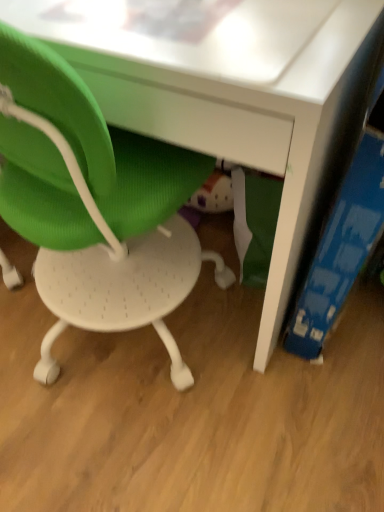
Question: Is green mesh chair at lower left inside blue cardboard book at right?

Choices:
 (A) no
 (B) yes

Answer: (A)

Question: Is blue cardboard book at right outside green mesh chair at lower left?

Choices:
 (A) no
 (B) yes

Answer: (B)

Question: From a real-world perspective, does blue cardboard book at right sit lower than green mesh chair at lower left?

Choices:
 (A) no
 (B) yes

Answer: (B)

Question: From a real-world perspective, does blue cardboard book at right stand above green mesh chair at lower left?

Choices:
 (A) yes
 (B) no

Answer: (B)

Question: Can you confirm if blue cardboard book at right is thinner than green mesh chair at lower left?

Choices:
 (A) no
 (B) yes

Answer: (B)

Question: Are blue cardboard book at right and green mesh chair at lower left beside each other?

Choices:
 (A) no
 (B) yes

Answer: (A)

Question: Is green mesh chair at lower left positioned beyond the bounds of blue cardboard book at right?

Choices:
 (A) yes
 (B) no

Answer: (A)

Question: From a real-world perspective, is green mesh chair at lower left physically above blue cardboard book at right?

Choices:
 (A) yes
 (B) no

Answer: (A)

Question: Is green mesh chair at lower left oriented away from blue cardboard book at right?

Choices:
 (A) no
 (B) yes

Answer: (A)

Question: Can you confirm if green mesh chair at lower left is shorter than blue cardboard book at right?

Choices:
 (A) no
 (B) yes

Answer: (A)

Question: Does green mesh chair at lower left appear on the left side of blue cardboard book at right?

Choices:
 (A) yes
 (B) no

Answer: (A)

Question: Are green mesh chair at lower left and blue cardboard book at right located far from each other?

Choices:
 (A) no
 (B) yes

Answer: (A)

Question: Is green mesh chair at lower left taller or shorter than blue cardboard book at right?

Choices:
 (A) tall
 (B) short

Answer: (A)